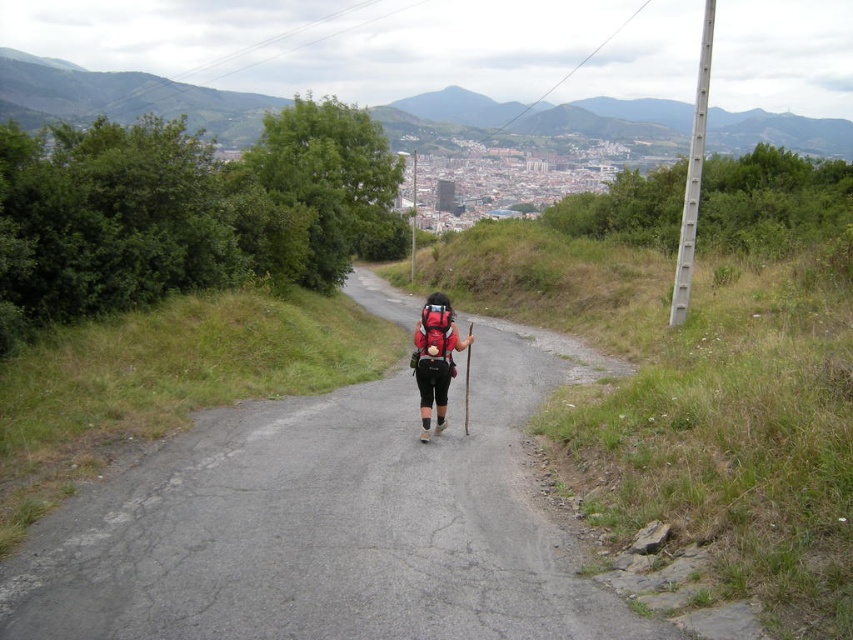
Does asphalt road at center come behind matte black backpack at center?

No, asphalt road at center is closer to the viewer.

Does asphalt road at center have a lesser height compared to matte black backpack at center?

Yes, asphalt road at center is shorter than matte black backpack at center.

Between point (497, 394) and point (426, 388), which one is positioned in front?

Point (426, 388)

You are a GUI agent. You are given a task and a screenshot of the screen. Output one action in this format:
    pyautogui.click(x=<x>, y=<y>)
    Task: Click on the asphalt road at center
    The width and height of the screenshot is (853, 640).
    Given the screenshot: What is the action you would take?
    pyautogui.click(x=325, y=525)